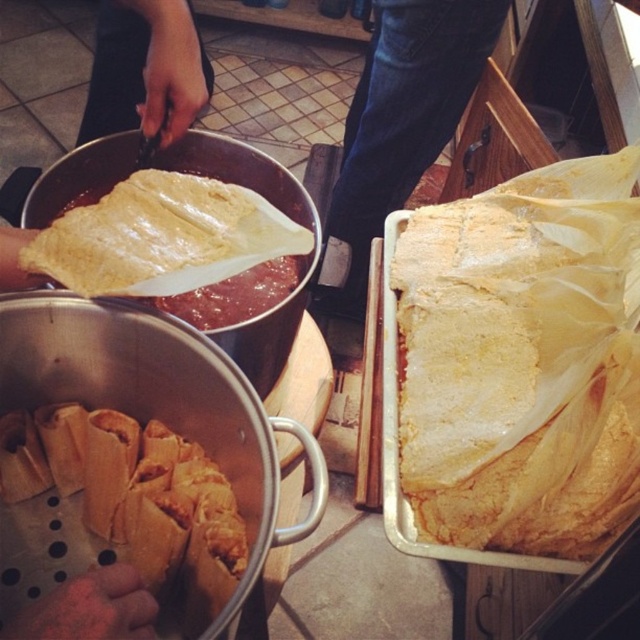
Question: Among these points, which one is farthest from the camera?

Choices:
 (A) (632, 266)
 (B) (240, 314)
 (C) (129, 554)

Answer: (B)

Question: Which point appears farthest from the camera in this image?

Choices:
 (A) (128, 500)
 (B) (136, 106)
 (C) (51, 236)

Answer: (B)

Question: Can you confirm if yellow paper wrapper at center is positioned to the left of yellowish matte corn tortilla at upper left?

Choices:
 (A) no
 (B) yes

Answer: (A)

Question: Can you confirm if yellow paper wrapper at center is wider than smooth beige tortilla at upper left?

Choices:
 (A) no
 (B) yes

Answer: (A)

Question: Which of the following is the closest to the observer?

Choices:
 (A) smooth beige tortilla at upper left
 (B) yellow paper wrapper at center

Answer: (B)

Question: Does smooth beige tortilla at upper left come in front of yellowish matte corn tortilla at upper left?

Choices:
 (A) yes
 (B) no

Answer: (B)